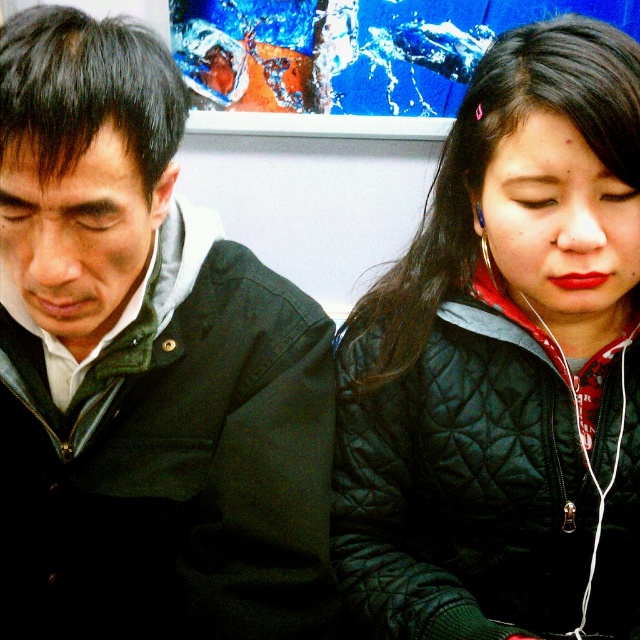
Question: Considering the relative positions of matte black jacket at left and black quilted jacket at center in the image provided, where is matte black jacket at left located with respect to black quilted jacket at center?

Choices:
 (A) left
 (B) right

Answer: (A)

Question: Is matte black jacket at left smaller than black quilted jacket at center?

Choices:
 (A) yes
 (B) no

Answer: (B)

Question: Which point is closer to the camera taking this photo?

Choices:
 (A) (81, 212)
 (B) (616, 406)

Answer: (A)

Question: Observing the image, what is the correct spatial positioning of matte black jacket at left in reference to black quilted jacket at center?

Choices:
 (A) above
 (B) below

Answer: (B)

Question: Which object appears closest to the camera in this image?

Choices:
 (A) black quilted jacket at center
 (B) matte black jacket at left

Answer: (B)